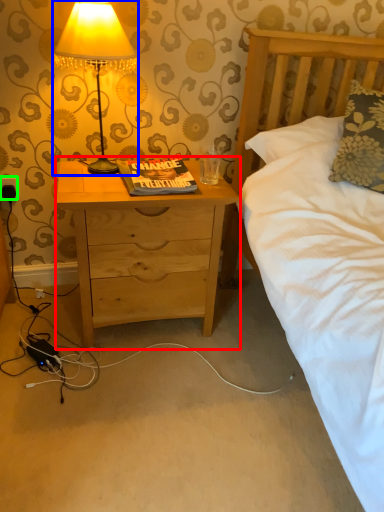
Question: Based on their relative distances, which object is farther from nightstand (highlighted by a red box)? Choose from lamp (highlighted by a blue box) and electric outlet (highlighted by a green box).

Choices:
 (A) lamp
 (B) electric outlet

Answer: (B)